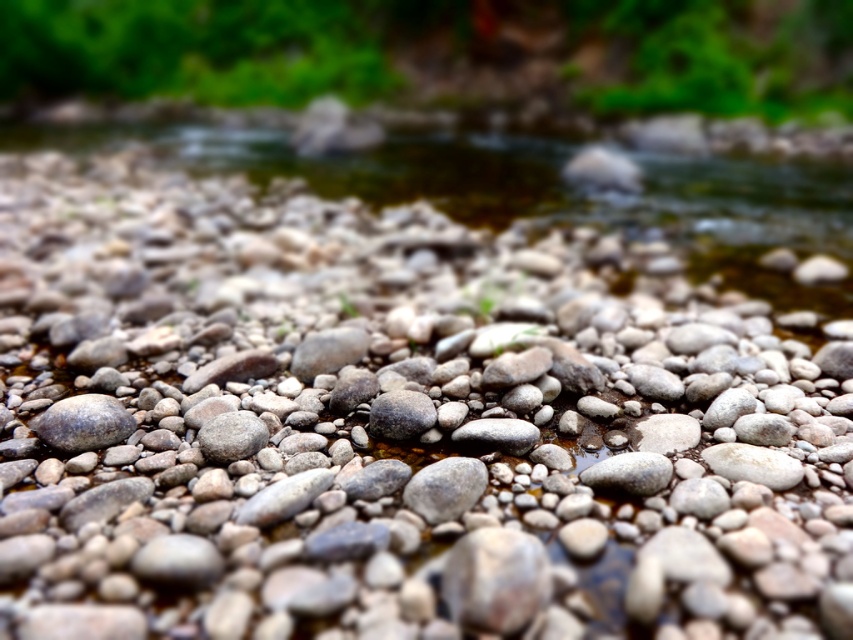
Does smooth gray stone at center have a smaller size compared to gray matte rock at center?

Indeed, smooth gray stone at center has a smaller size compared to gray matte rock at center.

Does point (407, 492) lie behind point (399, 440)?

That is False.

Describe the element at coordinates (445, 488) in the screenshot. I see `smooth gray stone at center` at that location.

Find the location of a particular element. Image resolution: width=853 pixels, height=640 pixels. smooth gray stone at center is located at coordinates (445, 488).

Who is shorter, smooth gray stone at center or smooth gray rock at center?

smooth gray rock at center

Based on the photo, which is more to the right, smooth gray stone at center or smooth gray rock at center?

From the viewer's perspective, smooth gray stone at center appears more on the right side.

Does point (445, 472) come behind point (264, 442)?

No, it is in front of (264, 442).

The width and height of the screenshot is (853, 640). Find the location of `smooth gray stone at center`. smooth gray stone at center is located at coordinates (445, 488).

Does smooth gray rock at lower left have a lesser height compared to gray matte rock at center?

Incorrect, smooth gray rock at lower left's height does not fall short of gray matte rock at center's.

Is smooth gray rock at lower left smaller than gray matte rock at center?

No.

Does point (68, 404) come behind point (422, 410)?

No, (68, 404) is in front of (422, 410).

The image size is (853, 640). Identify the location of smooth gray rock at lower left. (84, 422).